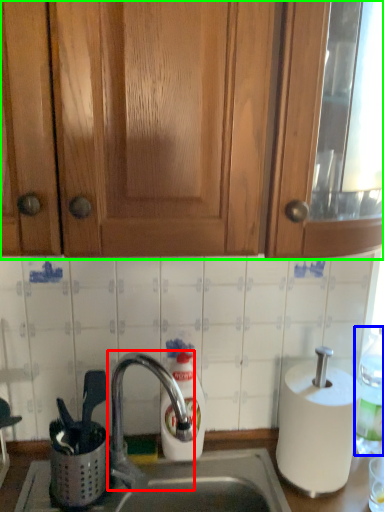
Question: Considering the real-world distances, which object is farthest from tap (highlighted by a red box)? bottle (highlighted by a blue box) or cabinetry (highlighted by a green box)?

Choices:
 (A) bottle
 (B) cabinetry

Answer: (B)